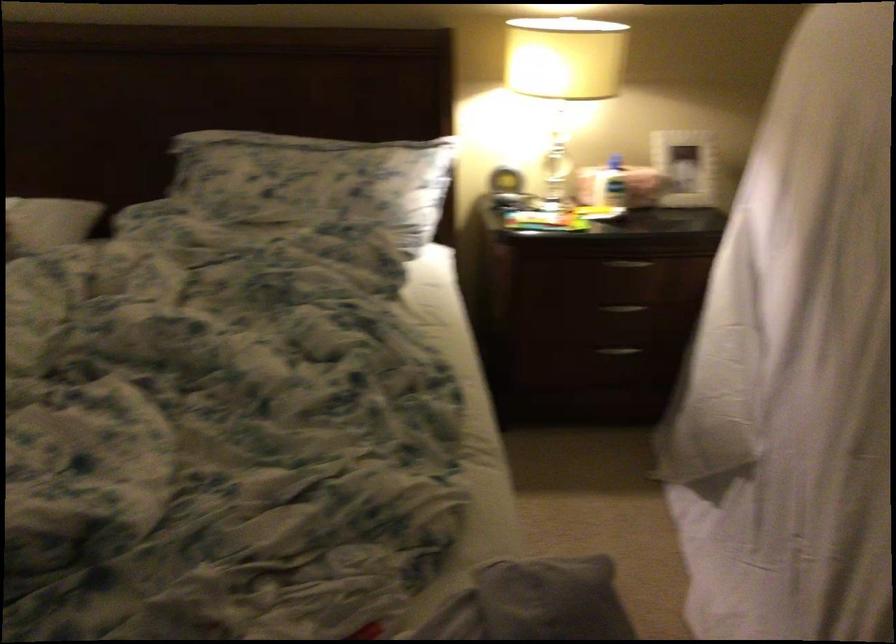
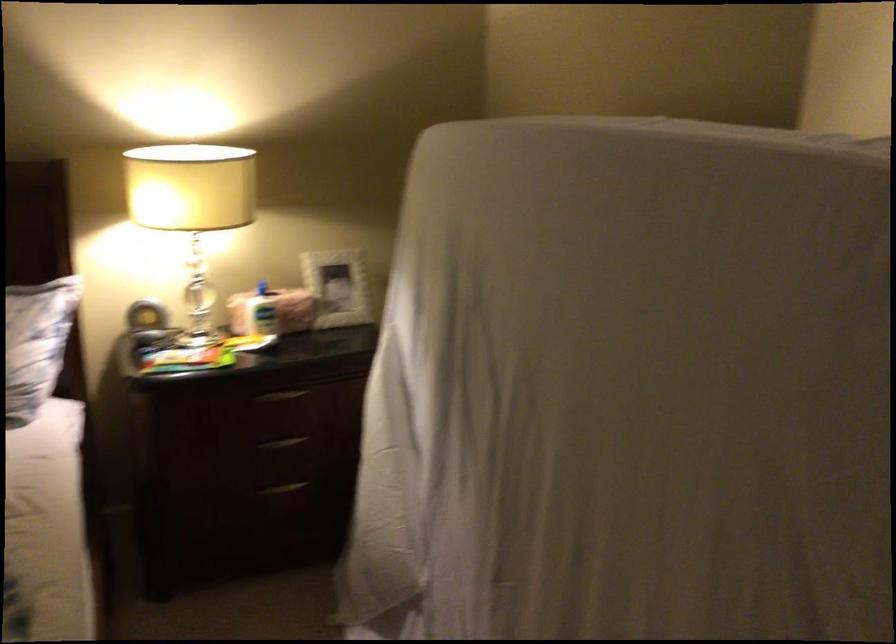
Locate, in the second image, the point that corresponds to point 625,178 in the first image.

(273, 310)